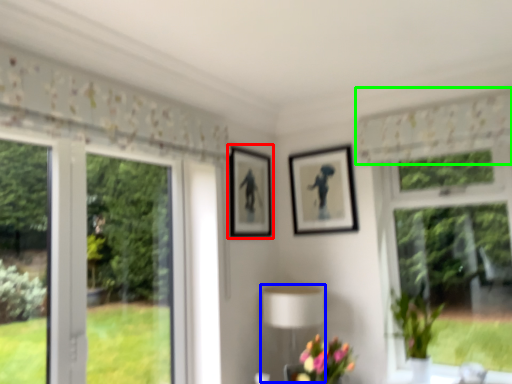
Question: Based on their relative distances, which object is farther from picture frame (highlighted by a red box)? Choose from table lamp (highlighted by a blue box) and curtain (highlighted by a green box).

Choices:
 (A) table lamp
 (B) curtain

Answer: (B)